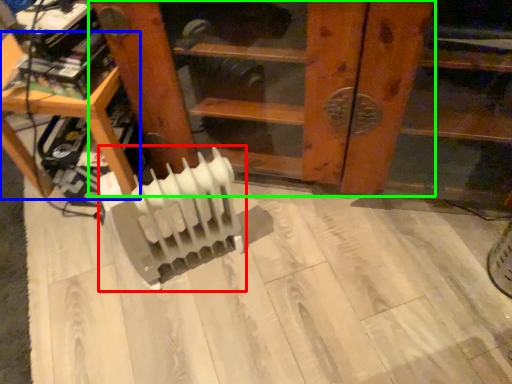
Question: Estimate the real-world distances between objects in this image. Which object is closer to radiator (highlighted by a red box), furniture (highlighted by a blue box) or furniture (highlighted by a green box)?

Choices:
 (A) furniture
 (B) furniture

Answer: (A)